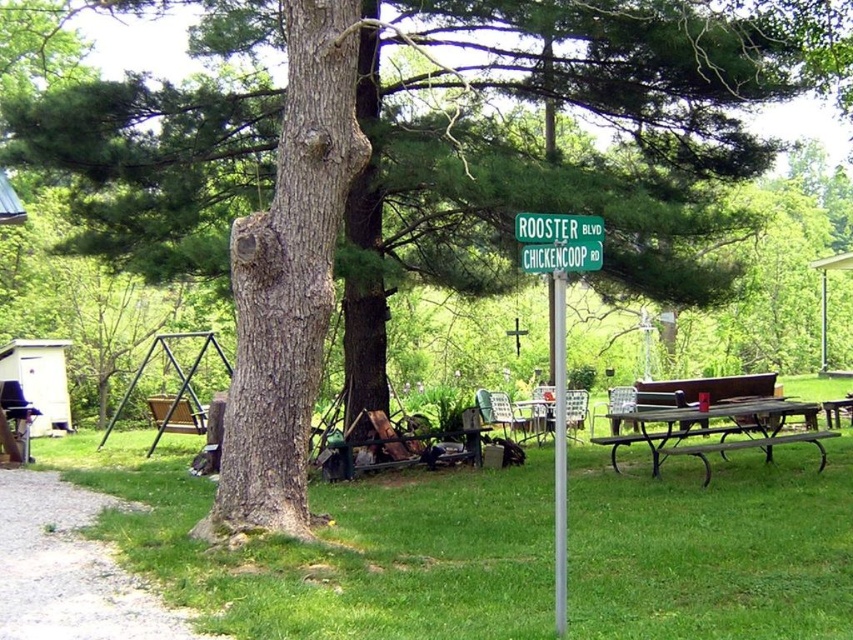
Identify the location of green metallic street sign at center. (560, 339).

Which is more to the left, green metallic street sign at center or brown wooden bench at lower right?

green metallic street sign at center

Who is more forward, [543,230] or [822,448]?

Point [543,230] is more forward.

I want to click on green metallic street sign at center, so click(560, 339).

In the scene shown: Is metallic brown picnic table at center further to camera compared to brown wooden bench at lower right?

Yes, it is behind brown wooden bench at lower right.

Does point (614, 454) come behind point (808, 433)?

Yes, point (614, 454) is farther from viewer.

The width and height of the screenshot is (853, 640). I want to click on metallic brown picnic table at center, so click(x=714, y=428).

Is green plastic street sign at center to the right of silver metallic pole at center from the viewer's perspective?

Incorrect, green plastic street sign at center is not on the right side of silver metallic pole at center.

Does green plastic street sign at center have a larger size compared to silver metallic pole at center?

No.

What are the coordinates of `green plastic street sign at center` in the screenshot? It's located at (560, 241).